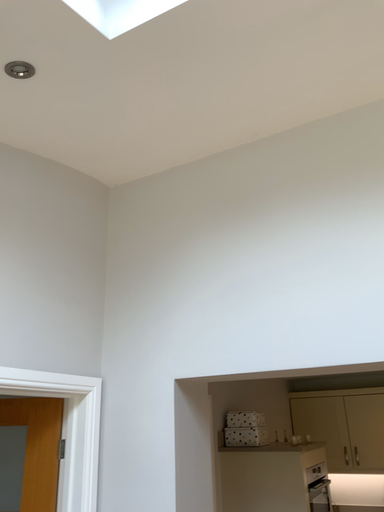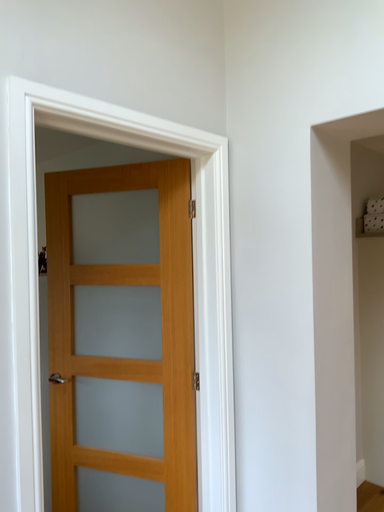
Question: Which way did the camera rotate in the video?

Choices:
 (A) rotated left
 (B) rotated right

Answer: (A)